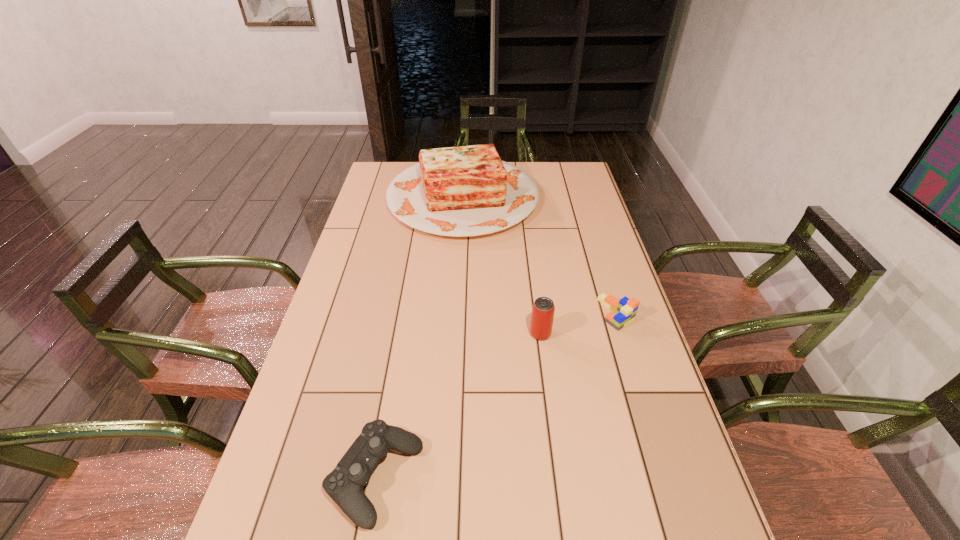
This screenshot has width=960, height=540. I want to click on lasagna situated at the left edge, so click(463, 191).

At what (x,y) coordinates should I click in order to perform the action: click on control positioned at the left edge. Please return your answer as a coordinate pair (x, y). The image size is (960, 540). Looking at the image, I should click on (344, 484).

The width and height of the screenshot is (960, 540). I want to click on object that is at the right edge, so click(623, 311).

Find the location of a particular element. The width and height of the screenshot is (960, 540). object that is at the far left corner is located at coordinates (463, 191).

At what (x,y) coordinates should I click in order to perform the action: click on free space at the left edge of the desktop. Please return your answer as a coordinate pair (x, y). Looking at the image, I should click on (339, 381).

Locate an element on the screen. This screenshot has height=540, width=960. free region at the right edge of the desktop is located at coordinates (559, 198).

This screenshot has height=540, width=960. Find the location of `free space at the far left corner of the desktop`. free space at the far left corner of the desktop is located at coordinates pyautogui.click(x=386, y=178).

I want to click on free space between the rightmost object and the nearest object, so click(x=495, y=395).

Find the location of `empty location between the beer can and the nearest object`. empty location between the beer can and the nearest object is located at coordinates (458, 406).

The height and width of the screenshot is (540, 960). Identify the location of empty space that is in between the rightmost object and the nearest object. (495, 395).